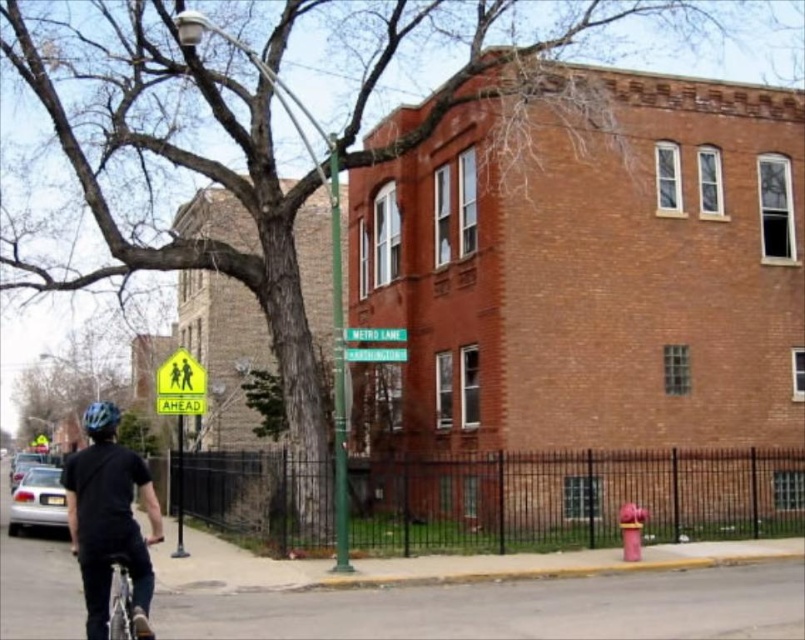
Question: Does shiny blue helmet at lower left have a greater width compared to green metallic street sign at upper center?

Choices:
 (A) no
 (B) yes

Answer: (B)

Question: Can you confirm if shiny blue helmet at lower left is positioned to the right of green metallic street sign at upper center?

Choices:
 (A) no
 (B) yes

Answer: (A)

Question: Is shiny blue helmet at lower left wider than green plastic street sign at center?

Choices:
 (A) no
 (B) yes

Answer: (B)

Question: Among these points, which one is nearest to the camera?

Choices:
 (A) (368, 349)
 (B) (114, 416)

Answer: (B)

Question: Based on their relative distances, which object is farther from the shiny blue helmet at lower left?

Choices:
 (A) green plastic street sign at center
 (B) matte pink fire hydrant at lower right

Answer: (B)

Question: Which object appears farthest from the camera in this image?

Choices:
 (A) black matte helmet at lower left
 (B) matte pink fire hydrant at lower right
 (C) silver metallic bicycle at lower left

Answer: (B)